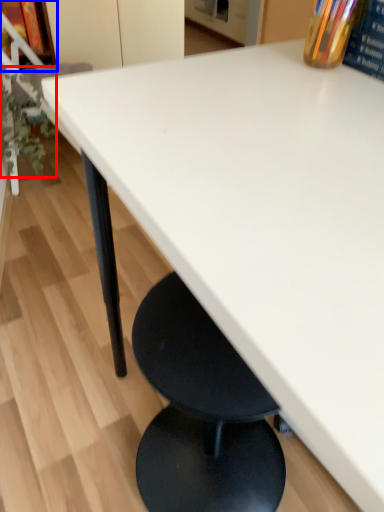
Question: Which of the following is the farthest to the observer, plant (highlighted by a red box) or shelf (highlighted by a blue box)?

Choices:
 (A) plant
 (B) shelf

Answer: (B)